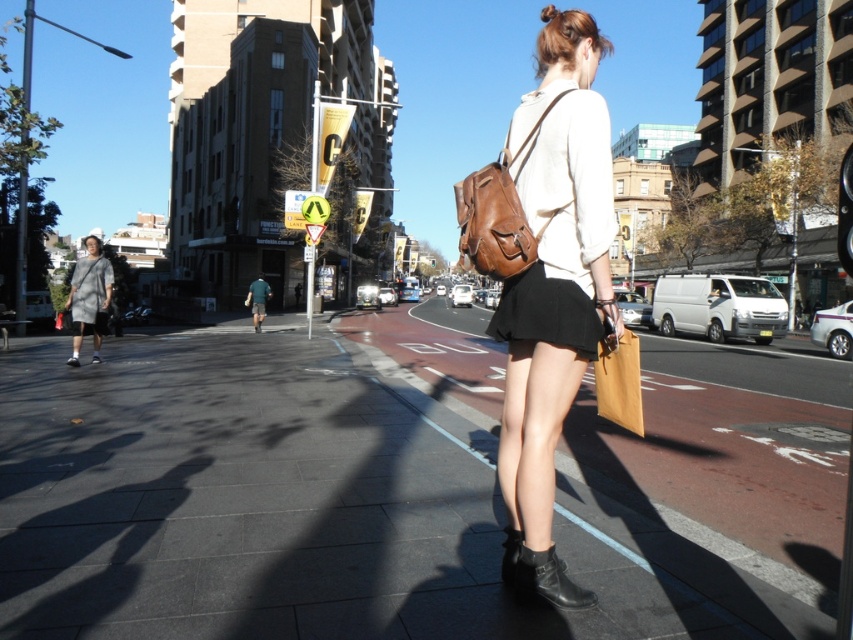
You are a fashion designer observing the woman in the scene. You need to determine which item is taller between the black matte skirt at center and the brown leather backpack at upper center. Based on the description, which one is taller?

The brown leather backpack at upper center is taller than the black matte skirt at center.

Consider the image. You are a delivery person who needs to deliver a package to the person in the image. The package is 2 meters long and needs to be placed between the black matte skirt at center and the blonde hair at upper center. Is there enough space to place the package without moving either object?

The distance between the black matte skirt at center and the blonde hair at upper center is 21.60 meters. Since the package is only 2 meters long, there is sufficient space to place it between them without needing to move either object.